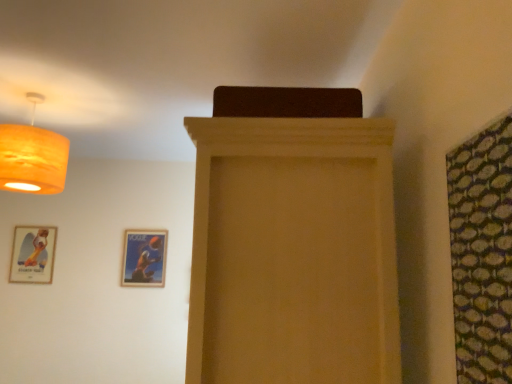
Question: Considering the relative sizes of matte wood cabinet at center and matte orange lampshade at upper left in the image provided, is matte wood cabinet at center taller than matte orange lampshade at upper left?

Choices:
 (A) no
 (B) yes

Answer: (B)

Question: Can you confirm if matte wood cabinet at center is positioned to the left of matte orange lampshade at upper left?

Choices:
 (A) yes
 (B) no

Answer: (B)

Question: From a real-world perspective, is matte wood cabinet at center beneath matte orange lampshade at upper left?

Choices:
 (A) no
 (B) yes

Answer: (B)

Question: Can you confirm if matte wood cabinet at center is bigger than matte orange lampshade at upper left?

Choices:
 (A) no
 (B) yes

Answer: (B)

Question: From the image's perspective, is matte wood cabinet at center on top of matte orange lampshade at upper left?

Choices:
 (A) yes
 (B) no

Answer: (B)

Question: Is matte wood cabinet at center in front of matte orange lampshade at upper left?

Choices:
 (A) no
 (B) yes

Answer: (B)

Question: Could matte orange lampshade at upper left be considered to be inside wooden glossy picture frame at lower center, acting as the second picture frame starting from the left?

Choices:
 (A) yes
 (B) no

Answer: (B)

Question: From the image's perspective, is wooden glossy picture frame at lower center, marked as the 1th picture frame in a right-to-left arrangement, located beneath matte orange lampshade at upper left?

Choices:
 (A) yes
 (B) no

Answer: (A)

Question: Considering the relative positions of wooden glossy picture frame at lower center, marked as the 1th picture frame in a right-to-left arrangement, and matte orange lampshade at upper left in the image provided, is wooden glossy picture frame at lower center, marked as the 1th picture frame in a right-to-left arrangement, to the left of matte orange lampshade at upper left from the viewer's perspective?

Choices:
 (A) no
 (B) yes

Answer: (A)

Question: Considering the relative sizes of wooden glossy picture frame at lower center, marked as the 1th picture frame in a right-to-left arrangement, and matte orange lampshade at upper left in the image provided, is wooden glossy picture frame at lower center, marked as the 1th picture frame in a right-to-left arrangement, shorter than matte orange lampshade at upper left?

Choices:
 (A) no
 (B) yes

Answer: (B)

Question: Is wooden glossy picture frame at lower center, acting as the second picture frame starting from the left, next to matte orange lampshade at upper left?

Choices:
 (A) yes
 (B) no

Answer: (B)

Question: From the image's perspective, is wooden glossy picture frame at lower center, acting as the second picture frame starting from the left, located above matte orange lampshade at upper left?

Choices:
 (A) yes
 (B) no

Answer: (B)

Question: From the image's perspective, is matte gold picture frame at lower left, the first picture frame in the left-to-right sequence, located beneath green textured fabric at right?

Choices:
 (A) no
 (B) yes

Answer: (B)